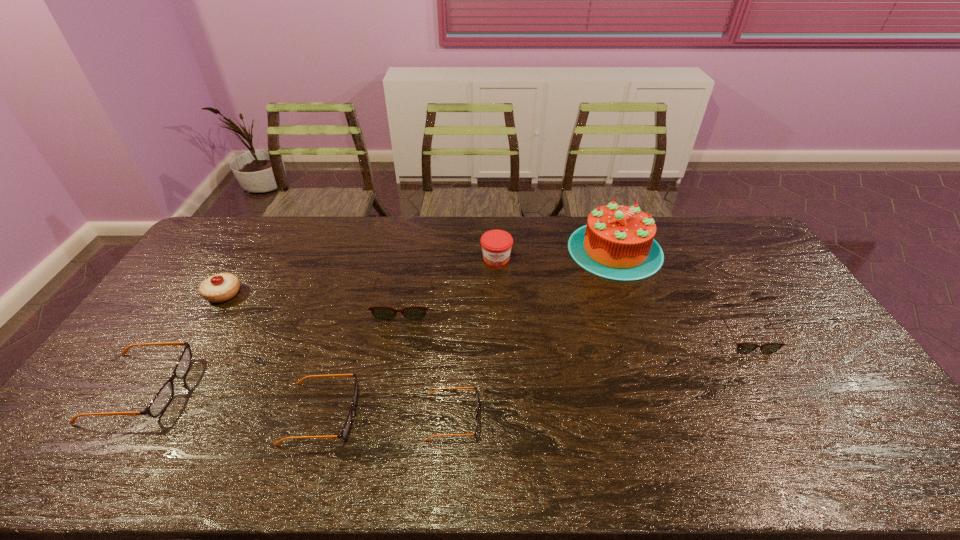
This screenshot has height=540, width=960. Identify the location of object that ranks as the fourth closest to the rightmost black spectacles. (617, 243).

Locate an element on the screen. The height and width of the screenshot is (540, 960). spectacles that stands as the fourth closest to the tallest object is located at coordinates (346, 428).

Where is `spectacles that stands as the fourth closest to the leftmost spectacles`? spectacles that stands as the fourth closest to the leftmost spectacles is located at coordinates (742, 348).

Identify the location of black spectacles that can be found as the second closest to the fourth spectacles from left to right. This screenshot has height=540, width=960. (161, 400).

The image size is (960, 540). I want to click on black spectacles that is the third closest to the farthest spectacles, so click(161, 400).

The image size is (960, 540). In order to click on vacant space that satisfies the following two spatial constraints: 1. at the front view of the smaller brown spectacles; 2. on the front-facing side of the leftmost spectacles in this screenshot , I will do `click(775, 388)`.

You are a GUI agent. You are given a task and a screenshot of the screen. Output one action in this format:
    pyautogui.click(x=<x>, y=<y>)
    Task: Click on the blank space that satisfies the following two spatial constraints: 1. at the front view of the nearer brown spectacles; 2. on the front-facing side of the fourth spectacles from left to right
    Image resolution: width=960 pixels, height=540 pixels.
    Given the screenshot: What is the action you would take?
    pyautogui.click(x=792, y=417)

Where is `free space that satisfies the following two spatial constraints: 1. at the front view of the left brown spectacles; 2. on the front-facing side of the leftmost spectacles`? free space that satisfies the following two spatial constraints: 1. at the front view of the left brown spectacles; 2. on the front-facing side of the leftmost spectacles is located at coordinates (389, 388).

Identify the location of vacant area in the image that satisfies the following two spatial constraints: 1. on the label side of the jam; 2. on the front-facing side of the biggest black spectacles. The height and width of the screenshot is (540, 960). (502, 388).

In order to click on vacant area that satisfies the following two spatial constraints: 1. on the label side of the red jam; 2. on the front-facing side of the second biggest black spectacles in this screenshot , I will do `click(503, 414)`.